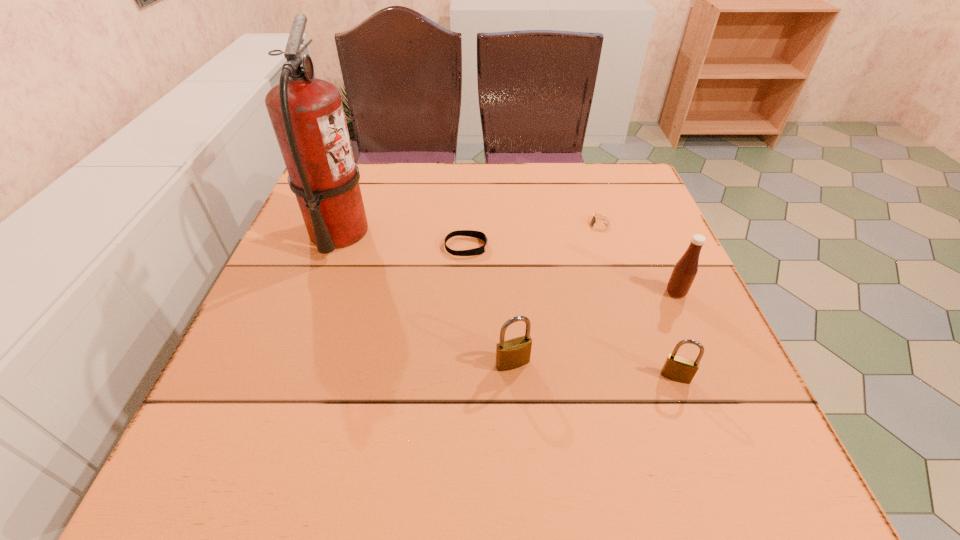
Please point out where to position a new padlock on the left to maintain spacing. Please provide its 2D coordinates. Your answer should be formatted as a tuple, i.e. [(x, y)], where the tuple contains the x and y coordinates of a point satisfying the conditions above.

[(358, 351)]